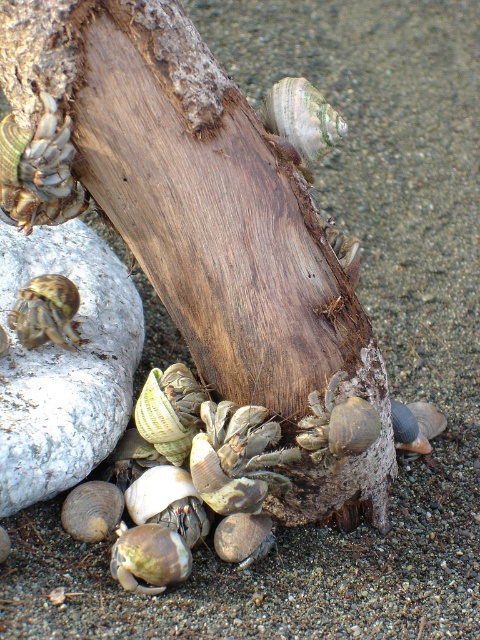
Can you confirm if matte brown shell at upper left is wider than smooth brown shell at center?

Yes.

Which is behind, point (80, 182) or point (434, 422)?

The point (434, 422) is more distant.

You are a GUI agent. You are given a task and a screenshot of the screen. Output one action in this format:
    pyautogui.click(x=<x>, y=<y>)
    Task: Click on the matte brown shell at upper left
    
    Given the screenshot: What is the action you would take?
    pyautogui.click(x=38, y=172)

Measure the distance from white rock at left to matte brown shell at upper left.

The distance of white rock at left from matte brown shell at upper left is 16.12 inches.

Does point (23, 378) come closer to viewer compared to point (9, 211)?

No, it is not.

Does point (33, 244) come behind point (41, 144)?

Yes, it is behind point (41, 144).

Where is `white rock at left`? Image resolution: width=480 pixels, height=640 pixels. white rock at left is located at coordinates (64, 365).

Is matte brown shell at upper left smaller than brown textured hermit crab at lower left?

Actually, matte brown shell at upper left might be larger than brown textured hermit crab at lower left.

Who is higher up, matte brown shell at upper left or brown textured hermit crab at lower left?

Positioned higher is matte brown shell at upper left.

Is point (31, 179) positioned behind point (70, 337)?

No, it is in front of (70, 337).

Where is `matte brown shell at upper left`? Image resolution: width=480 pixels, height=640 pixels. matte brown shell at upper left is located at coordinates (38, 172).